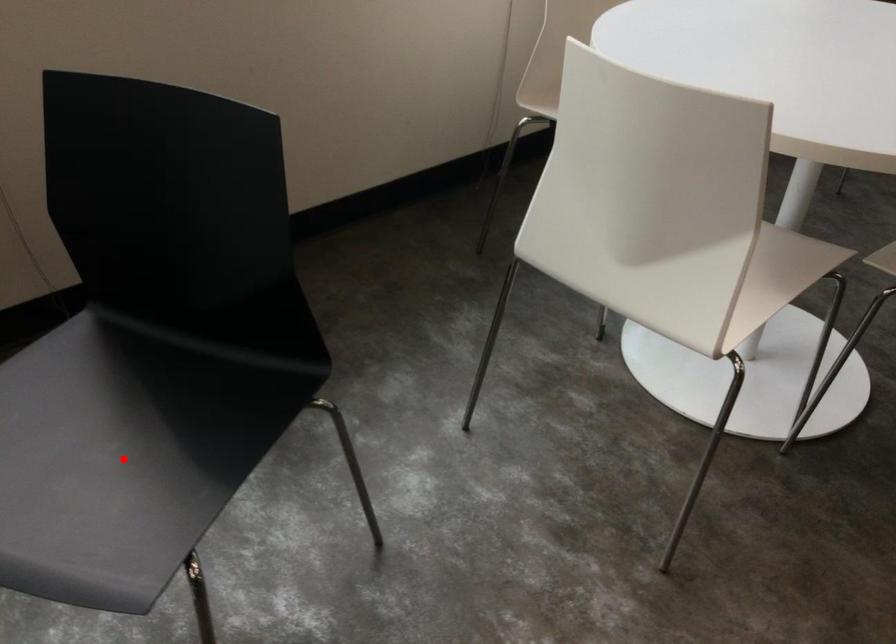
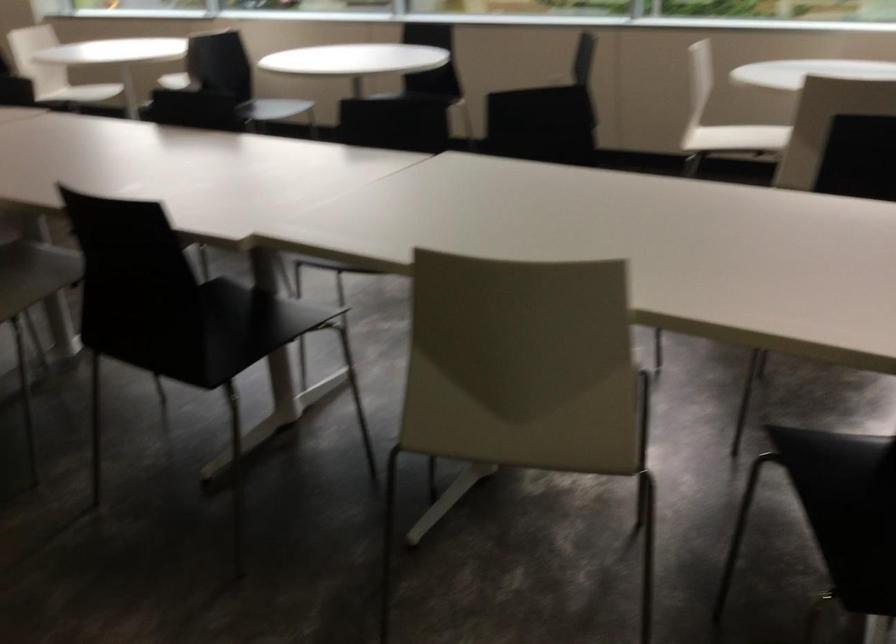
Question: I am providing you with two images of the same scene from different viewpoints. A red point is marked on the first image. Is the red point's position out of view in image 2?

Choices:
 (A) Yes
 (B) No

Answer: (A)